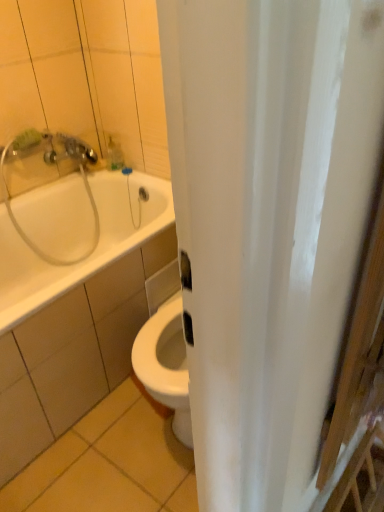
You are a GUI agent. You are given a task and a screenshot of the screen. Output one action in this format:
    pyautogui.click(x=<x>, y=<y>)
    Task: Click on the white glossy bathtub at upper left
    This screenshot has width=384, height=512.
    Given the screenshot: What is the action you would take?
    coord(75,316)

The height and width of the screenshot is (512, 384). Describe the element at coordinates (75, 316) in the screenshot. I see `white glossy bathtub at upper left` at that location.

You are a GUI agent. You are given a task and a screenshot of the screen. Output one action in this format:
    pyautogui.click(x=<x>, y=<y>)
    Task: Click on the white glossy bathtub at upper left
    Image resolution: width=384 pixels, height=512 pixels.
    Given the screenshot: What is the action you would take?
    pyautogui.click(x=75, y=316)